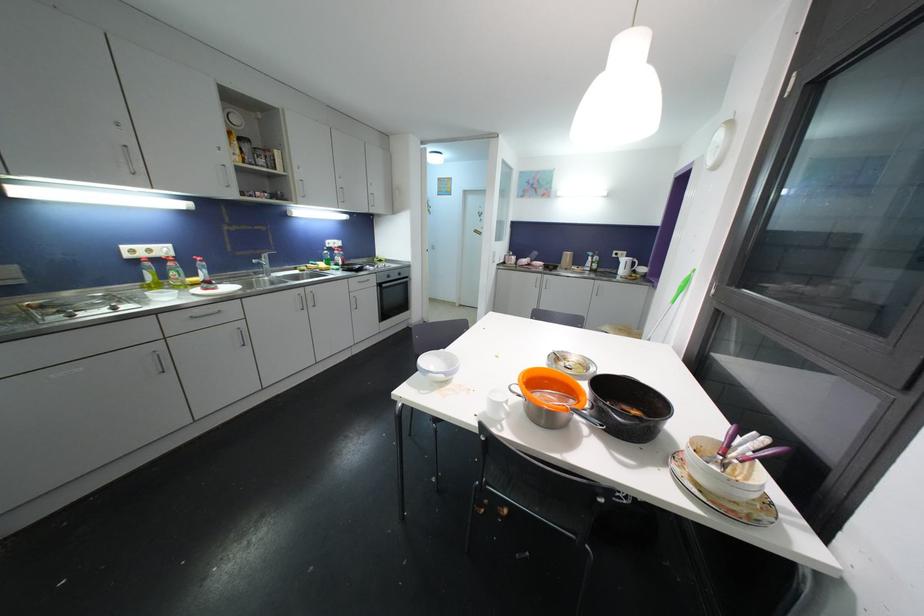
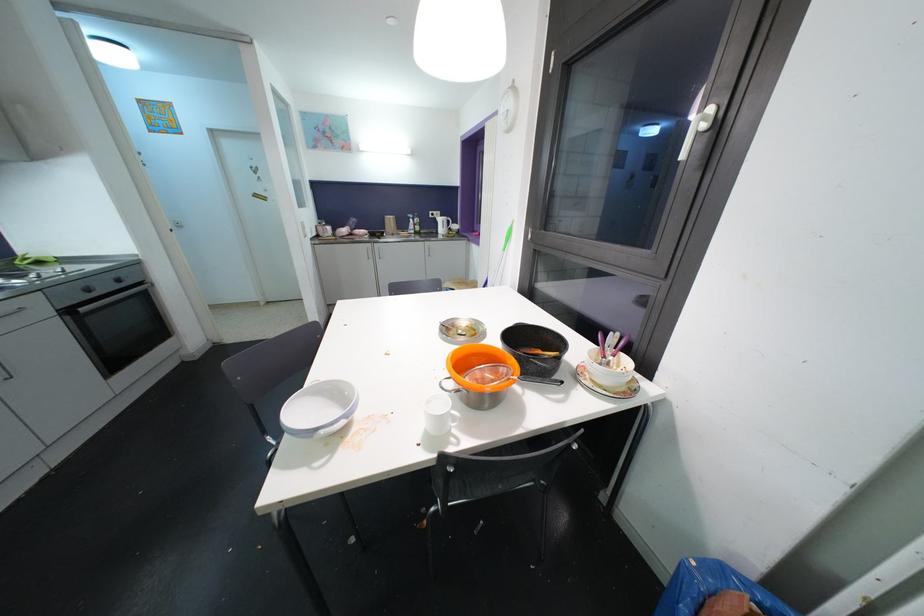
Locate, in the second image, the point that corresponds to point 627,264 in the first image.

(444, 223)